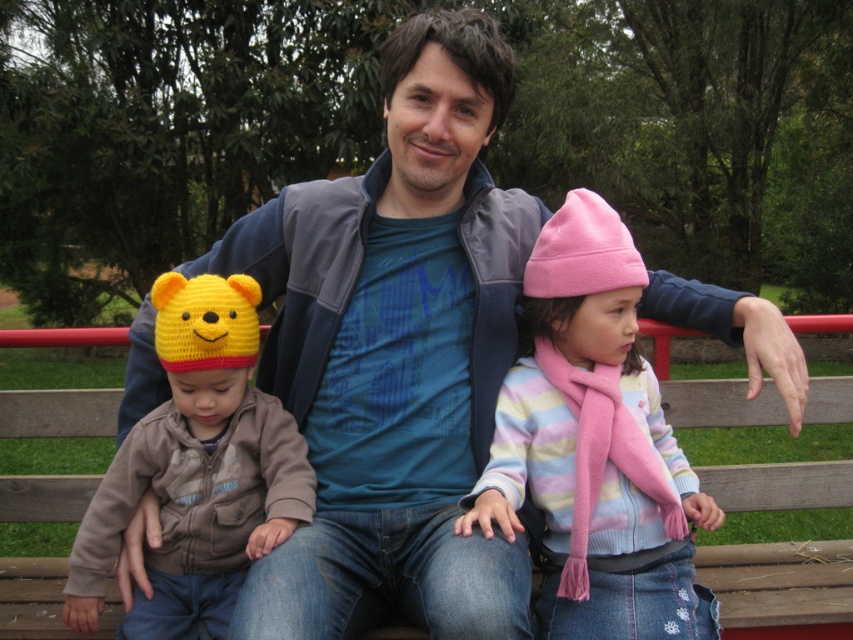
Question: Which point is farther to the camera?

Choices:
 (A) (202, 445)
 (B) (607, 372)

Answer: (B)

Question: Is pink fleece hat at center to the left of knitted yellow hat at left from the viewer's perspective?

Choices:
 (A) yes
 (B) no

Answer: (B)

Question: Does pink fleece hat at center appear over knitted yellow hat at left?

Choices:
 (A) no
 (B) yes

Answer: (B)

Question: Considering the relative positions of pink fleece hat at center and knitted yellow hat at left in the image provided, where is pink fleece hat at center located with respect to knitted yellow hat at left?

Choices:
 (A) below
 (B) above

Answer: (B)

Question: Which point is farther from the camera taking this photo?

Choices:
 (A) (529, 480)
 (B) (190, 296)

Answer: (A)

Question: Which point is farther from the camera taking this photo?

Choices:
 (A) (619, 317)
 (B) (213, 480)

Answer: (B)